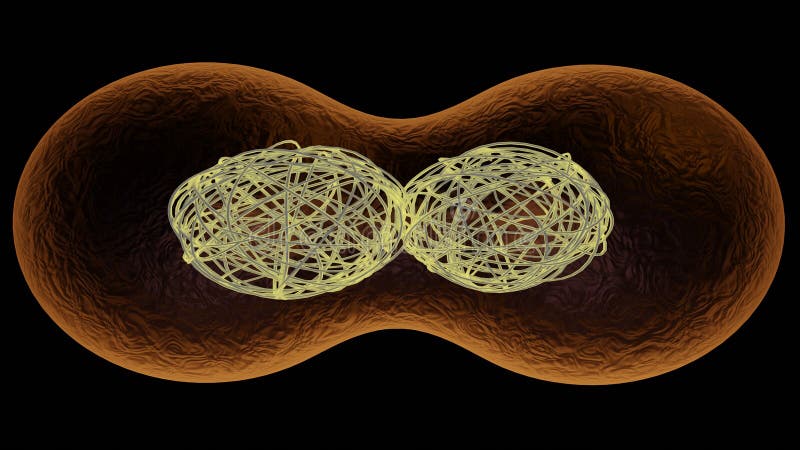
This screenshot has width=800, height=450. In order to click on plant in this screenshot , I will do `click(660, 327)`.